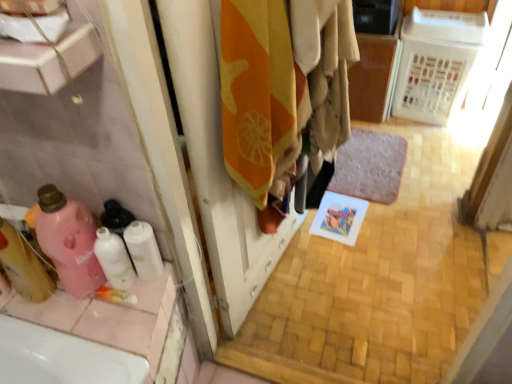
Where is `free spot to the right of orange fabric at center`? This screenshot has height=384, width=512. free spot to the right of orange fabric at center is located at coordinates (340, 277).